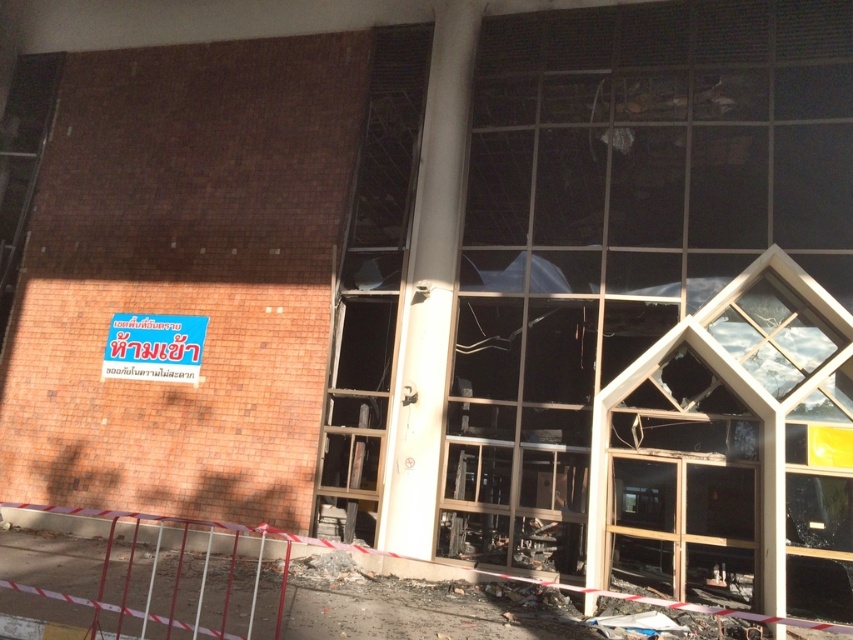
Question: Is transparent glass window at right wider than transparent glass door at center?

Choices:
 (A) no
 (B) yes

Answer: (A)

Question: Does transparent glass window at right appear under blue plastic sign at upper left?

Choices:
 (A) yes
 (B) no

Answer: (A)

Question: Which of the following is the closest to the observer?

Choices:
 (A) transparent glass door at center
 (B) blue plastic sign at upper left
 (C) transparent glass window at right

Answer: (C)

Question: Is transparent glass door at center above blue plastic sign at upper left?

Choices:
 (A) no
 (B) yes

Answer: (B)

Question: Which point is closer to the camera taking this photo?

Choices:
 (A) [x=660, y=161]
 (B) [x=149, y=372]
 (C) [x=387, y=346]

Answer: (B)

Question: Which object is the farthest from the transparent glass door at center?

Choices:
 (A) blue plastic sign at upper left
 (B) transparent glass window at right

Answer: (B)